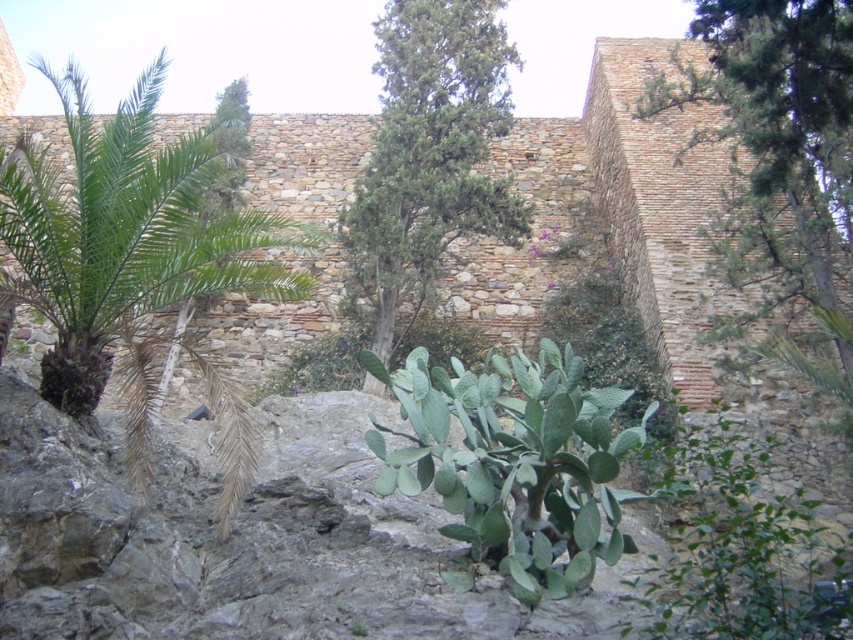
You are standing in front of the rustic stone wall and want to touch both the green leafy palm at left and the green leafy tree at upper right. Which one would you reach first?

The green leafy palm at left is closer to the viewer than the green leafy tree at upper right, so you would reach the green leafy palm at left first.

Looking at this image, you are an architect designing a garden next to the rustic stone wall. You need to place both the green leafy tree at upper right and the green leafy tree at center. Which tree should you place first if you want to plant the taller one closer to the wall?

The green leafy tree at center is taller than the green leafy tree at upper right, so you should place the green leafy tree at center closer to the wall first.